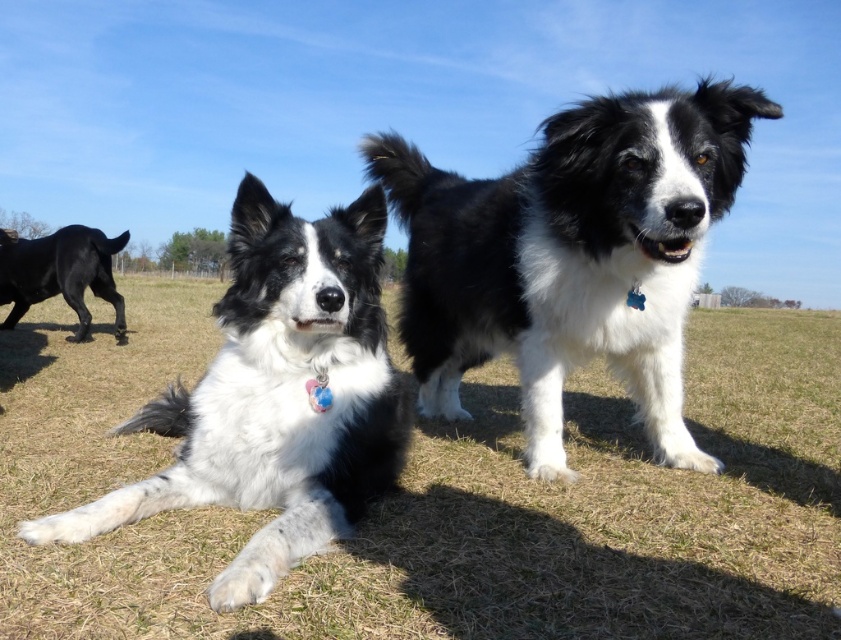
Question: Is white fur dog at center to the right of black glossy dog at left from the viewer's perspective?

Choices:
 (A) no
 (B) yes

Answer: (B)

Question: Among these points, which one is nearest to the camera?

Choices:
 (A) (554, 275)
 (B) (110, 252)
 (C) (437, 598)
 (D) (358, 458)

Answer: (C)

Question: Does white fur dog at center have a smaller size compared to black and white fur at center?

Choices:
 (A) yes
 (B) no

Answer: (B)

Question: Which object is positioned farthest from the black and white fur at center?

Choices:
 (A) black and white fur dog at center
 (B) white fur dog at center

Answer: (B)

Question: From the image, what is the correct spatial relationship of white fur dog at center in relation to black and white fur at center?

Choices:
 (A) below
 (B) above

Answer: (A)

Question: Which point is farther from the camera taking this photo?

Choices:
 (A) tap(181, 497)
 (B) tap(98, 292)
 (C) tap(471, 301)
 (D) tap(734, 461)

Answer: (B)